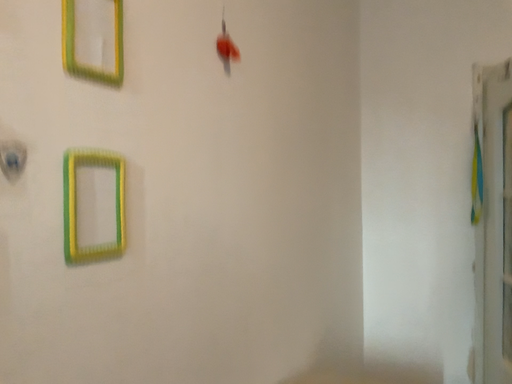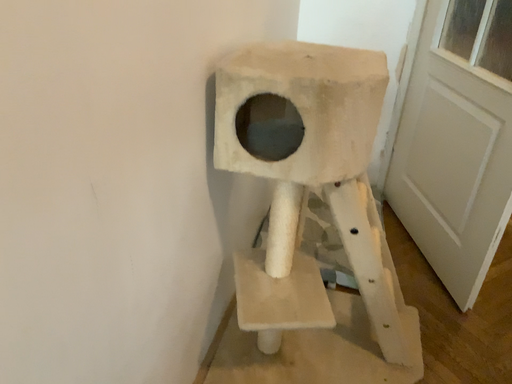
Question: Which way did the camera rotate in the video?

Choices:
 (A) rotated upward
 (B) rotated downward

Answer: (B)